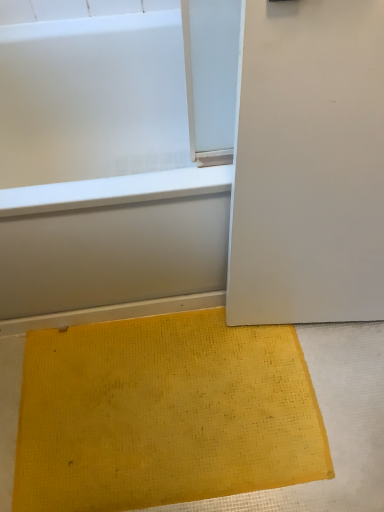
Question: Does white glossy bathtub at lower left have a larger size compared to yellow woven mat at lower center?

Choices:
 (A) yes
 (B) no

Answer: (A)

Question: Is yellow woven mat at lower center at the back of white glossy bathtub at lower left?

Choices:
 (A) yes
 (B) no

Answer: (B)

Question: From the image's perspective, is white glossy bathtub at lower left over yellow woven mat at lower center?

Choices:
 (A) no
 (B) yes

Answer: (B)

Question: Does white glossy bathtub at lower left have a greater height compared to yellow woven mat at lower center?

Choices:
 (A) no
 (B) yes

Answer: (B)

Question: Does white glossy bathtub at lower left have a smaller size compared to yellow woven mat at lower center?

Choices:
 (A) no
 (B) yes

Answer: (A)

Question: Is white glossy bathtub at lower left behind yellow woven mat at lower center?

Choices:
 (A) no
 (B) yes

Answer: (A)

Question: Is yellow woven mat at lower center taller than white glossy bathtub at lower left?

Choices:
 (A) no
 (B) yes

Answer: (A)

Question: Considering the relative sizes of yellow woven mat at lower center and white glossy bathtub at lower left in the image provided, is yellow woven mat at lower center shorter than white glossy bathtub at lower left?

Choices:
 (A) no
 (B) yes

Answer: (B)

Question: Can you confirm if yellow woven mat at lower center is smaller than white glossy bathtub at lower left?

Choices:
 (A) no
 (B) yes

Answer: (B)

Question: Does yellow woven mat at lower center have a larger size compared to white glossy bathtub at lower left?

Choices:
 (A) no
 (B) yes

Answer: (A)

Question: Is yellow woven mat at lower center positioned behind white glossy bathtub at lower left?

Choices:
 (A) yes
 (B) no

Answer: (A)

Question: Is yellow woven mat at lower center facing away from white glossy bathtub at lower left?

Choices:
 (A) yes
 (B) no

Answer: (A)

Question: Relative to yellow woven mat at lower center, is white glossy bathtub at lower left in front or behind?

Choices:
 (A) front
 (B) behind

Answer: (A)